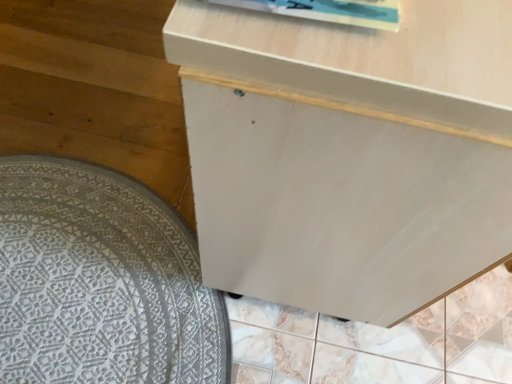
The image size is (512, 384). I want to click on empty space that is ontop of white textured mat at lower left, so click(x=95, y=263).